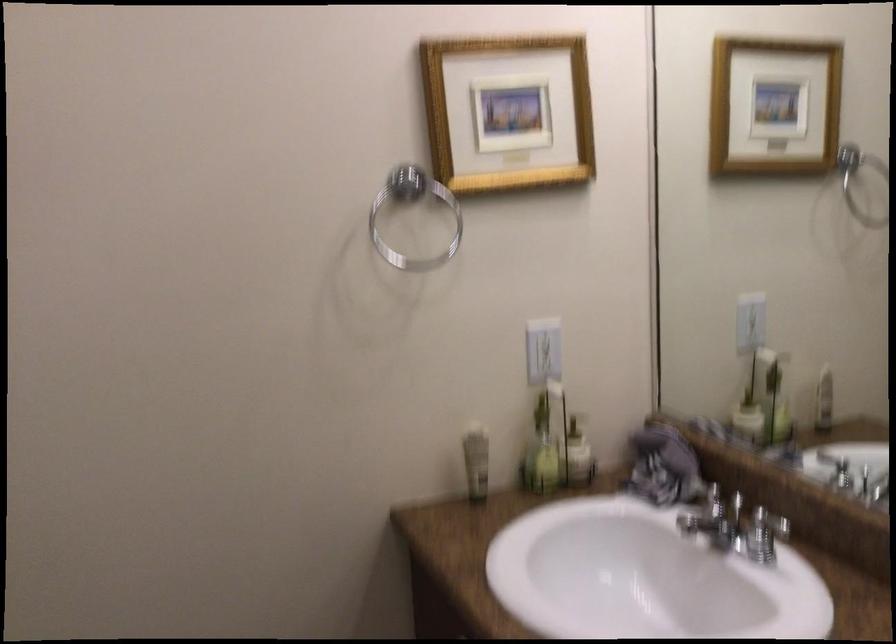
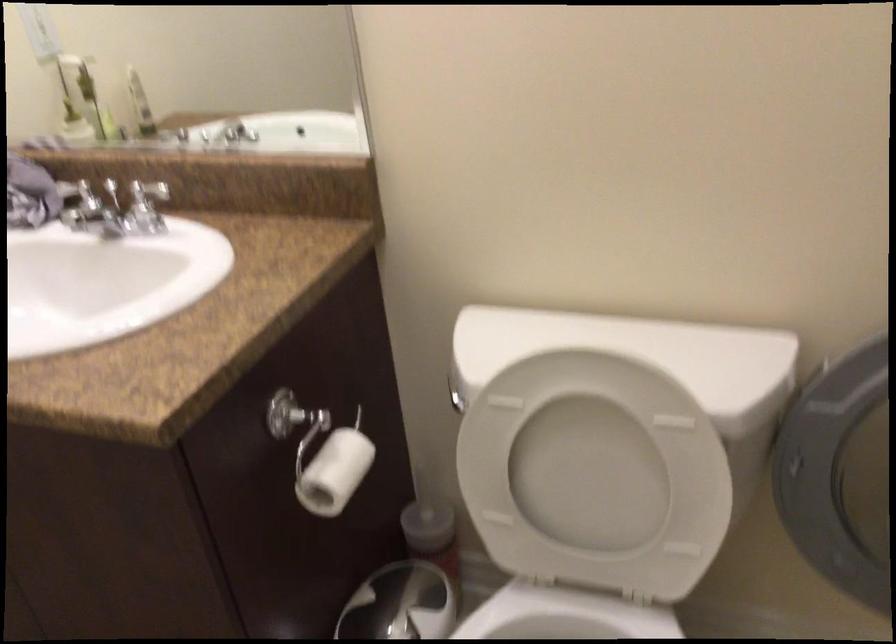
Find the pixel in the second image that matches the point at 790,503 in the first image.

(156, 182)